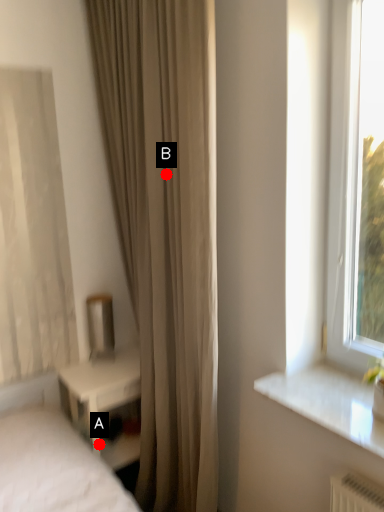
Question: Two points are circled on the image, labeled by A and B beside each circle. Which of the following is the farthest from the observer?

Choices:
 (A) A is further
 (B) B is further

Answer: (A)